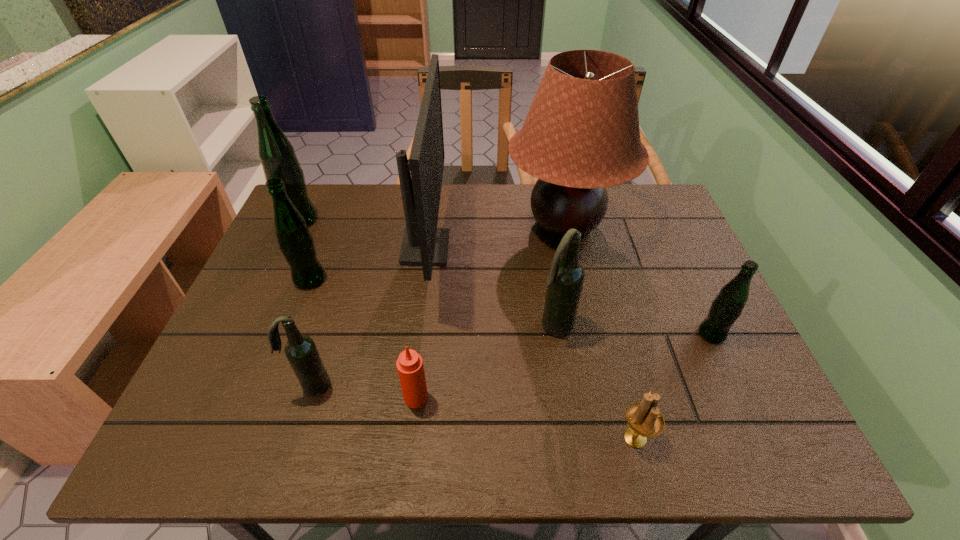
Where is `green beer bottle that is the second closest to the rightmost object`? green beer bottle that is the second closest to the rightmost object is located at coordinates (277, 155).

You are a GUI agent. You are given a task and a screenshot of the screen. Output one action in this format:
    pyautogui.click(x=<x>, y=<y>)
    Task: Click on the free location that satisfies the following two spatial constraints: 1. on the front-facing side of the computer monitor; 2. on the front side of the second nearest green beer bottle
    This screenshot has width=960, height=540.
    Given the screenshot: What is the action you would take?
    pos(421,279)

You are a GUI agent. You are given a task and a screenshot of the screen. Output one action in this format:
    pyautogui.click(x=<x>, y=<y>)
    Task: Click on the free space that satisfies the following two spatial constraints: 1. on the front-facing side of the Tabasco sauce; 2. on the left side of the computer monitor
    
    Given the screenshot: What is the action you would take?
    pyautogui.click(x=406, y=397)